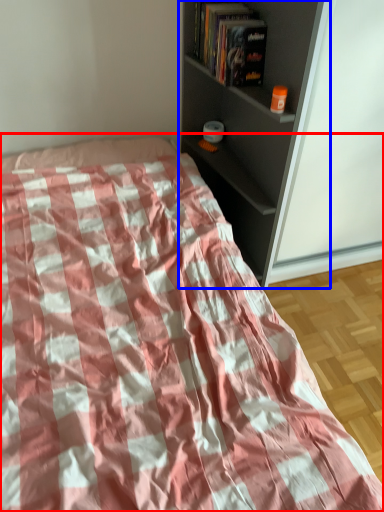
Question: Which of the following is the farthest to the observer, bed (highlighted by a red box) or shelf (highlighted by a blue box)?

Choices:
 (A) bed
 (B) shelf

Answer: (B)